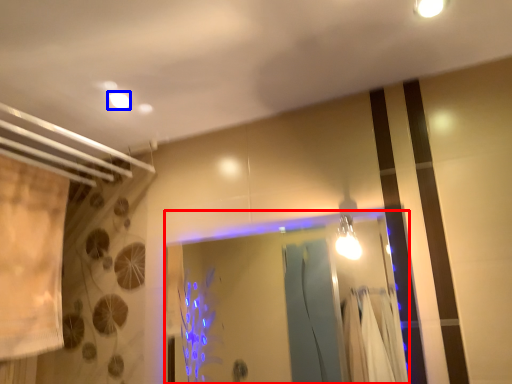
Question: Which of the following is the closest to the observer, glass door (highlighted by a red box) or lighting (highlighted by a blue box)?

Choices:
 (A) glass door
 (B) lighting

Answer: (A)